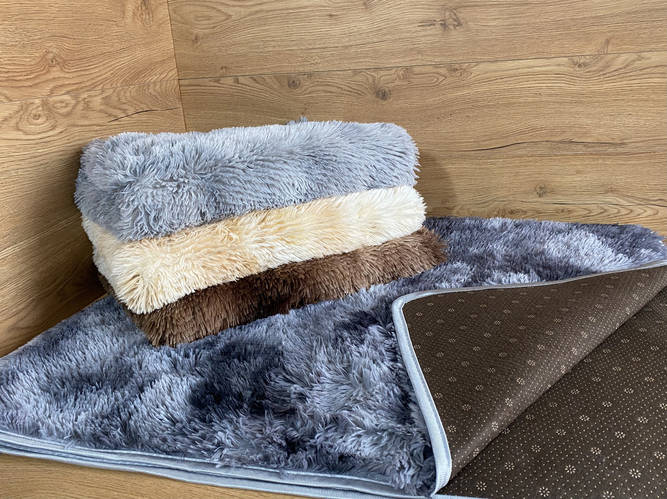
At what (x,y) coordinates should I click in order to perform the action: click on towel. Please return your answer as a coordinate pair (x, y). Image resolution: width=667 pixels, height=499 pixels. Looking at the image, I should click on (265, 172).